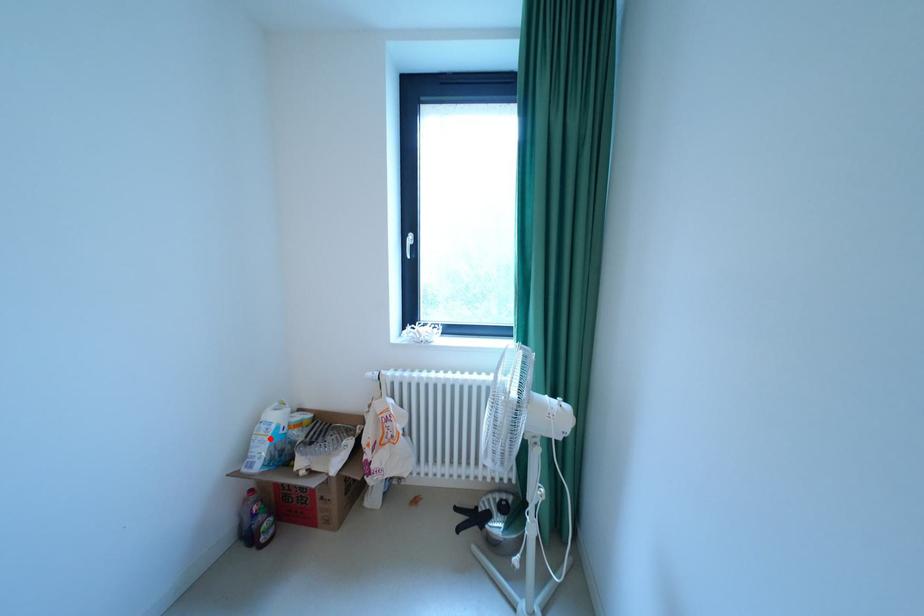
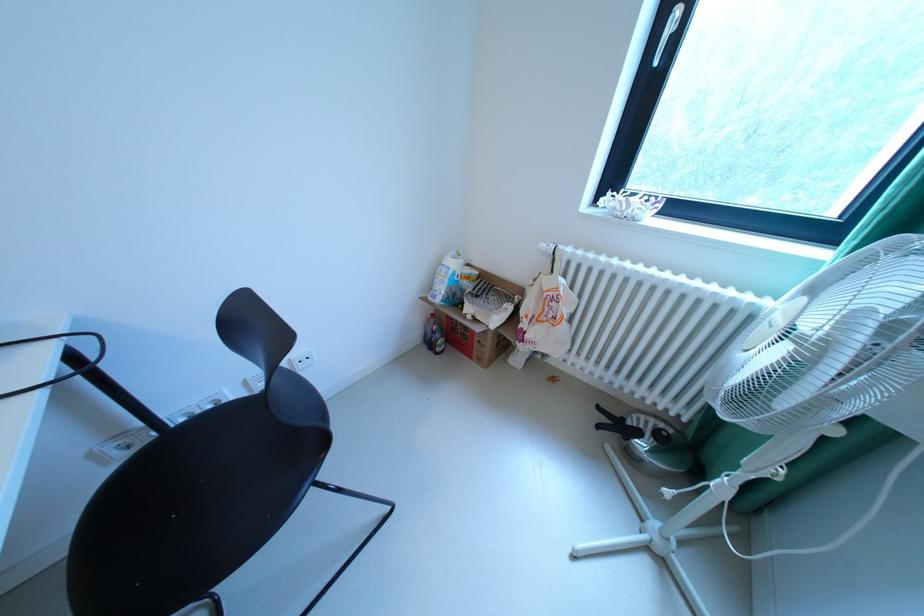
The point at the highlighted location is marked in the first image. Where is the corresponding point in the second image?

(451, 278)